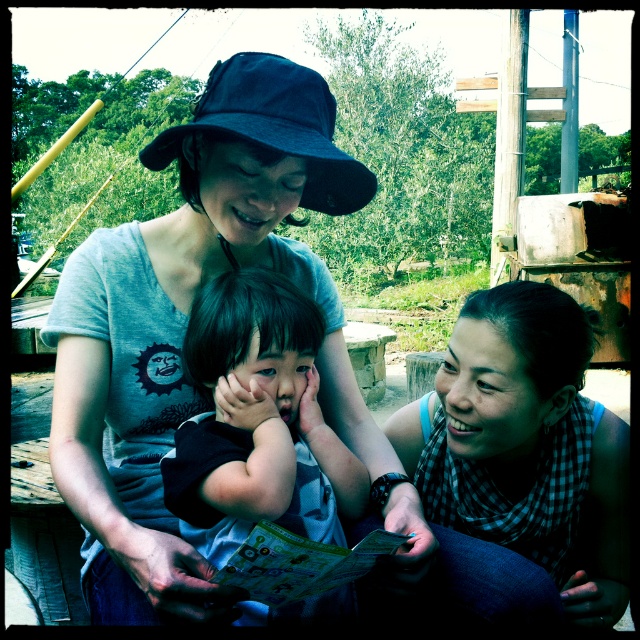
You are a photographer trying to capture a closeup of the matte gray shirt at center and the black matte baby at center. Which one should you focus on first to ensure it appears sharp in the photo?

The matte gray shirt at center is closer to the viewer than the black matte baby at center, so you should focus on the matte gray shirt at center first to ensure it appears sharp.

You are designing a gift box for a baby shower. The box has a width of 20 cm. The black matte baby at center and dark blue fabric baseball hat at upper center are both potential items to include. Based on their sizes, which item would fit better in the box?

The black matte baby at center has a lesser width compared to the dark blue fabric baseball hat at upper center, so the black matte baby at center would fit better in the 20 cm wide gift box.